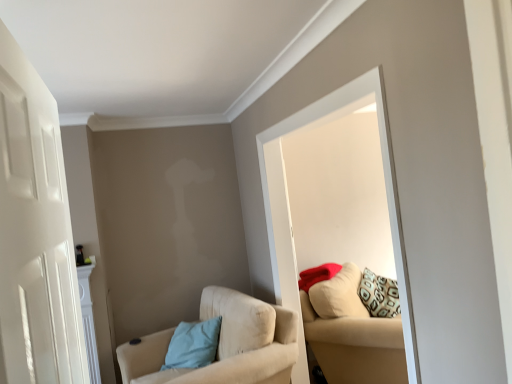
Question: Can you confirm if beige fabric couch at right is smaller than white glossy mirror at upper center?

Choices:
 (A) yes
 (B) no

Answer: (B)

Question: Does beige fabric couch at right turn towards white glossy mirror at upper center?

Choices:
 (A) no
 (B) yes

Answer: (A)

Question: Is beige fabric couch at right facing away from white glossy mirror at upper center?

Choices:
 (A) yes
 (B) no

Answer: (B)

Question: Considering the relative sizes of beige fabric couch at right and white glossy mirror at upper center in the image provided, is beige fabric couch at right shorter than white glossy mirror at upper center?

Choices:
 (A) no
 (B) yes

Answer: (B)

Question: Is beige fabric couch at right outside of white glossy mirror at upper center?

Choices:
 (A) no
 (B) yes

Answer: (B)

Question: In the image, is matte red pillow at upper right, marked as the 2th pillow in a left-to-right arrangement, on the left side or the right side of white matte door at left?

Choices:
 (A) left
 (B) right

Answer: (B)

Question: In terms of height, does matte red pillow at upper right, marked as the 2th pillow in a left-to-right arrangement, look taller or shorter compared to white matte door at left?

Choices:
 (A) short
 (B) tall

Answer: (A)

Question: Would you say matte red pillow at upper right, the 2th pillow ordered from the bottom, is inside or outside white matte door at left?

Choices:
 (A) outside
 (B) inside

Answer: (A)

Question: Looking at their shapes, would you say matte red pillow at upper right, marked as the 1th pillow in a right-to-left arrangement, is wider or thinner than white matte door at left?

Choices:
 (A) wide
 (B) thin

Answer: (A)

Question: Considering the relative positions of white matte door at left and light blue fabric pillow at lower left, which is the first pillow from left to right, in the image provided, is white matte door at left to the left or to the right of light blue fabric pillow at lower left, which is the first pillow from left to right,?

Choices:
 (A) right
 (B) left

Answer: (A)

Question: Relative to light blue fabric pillow at lower left, the 1th pillow in the bottom-to-top sequence, is white matte door at left in front or behind?

Choices:
 (A) behind
 (B) front

Answer: (B)

Question: Looking at the image, does white matte door at left seem bigger or smaller compared to light blue fabric pillow at lower left, the 1th pillow in the bottom-to-top sequence?

Choices:
 (A) small
 (B) big

Answer: (B)

Question: From the image's perspective, is white matte door at left positioned above or below light blue fabric pillow at lower left, which is the first pillow from left to right?

Choices:
 (A) below
 (B) above

Answer: (B)

Question: From a real-world perspective, is white glossy mirror at upper center positioned above or below light blue fabric pillow at lower left, which ranks as the second pillow in top-to-bottom order?

Choices:
 (A) below
 (B) above

Answer: (B)

Question: Considering their positions, is white glossy mirror at upper center located in front of or behind light blue fabric pillow at lower left, the 1th pillow in the bottom-to-top sequence?

Choices:
 (A) front
 (B) behind

Answer: (A)